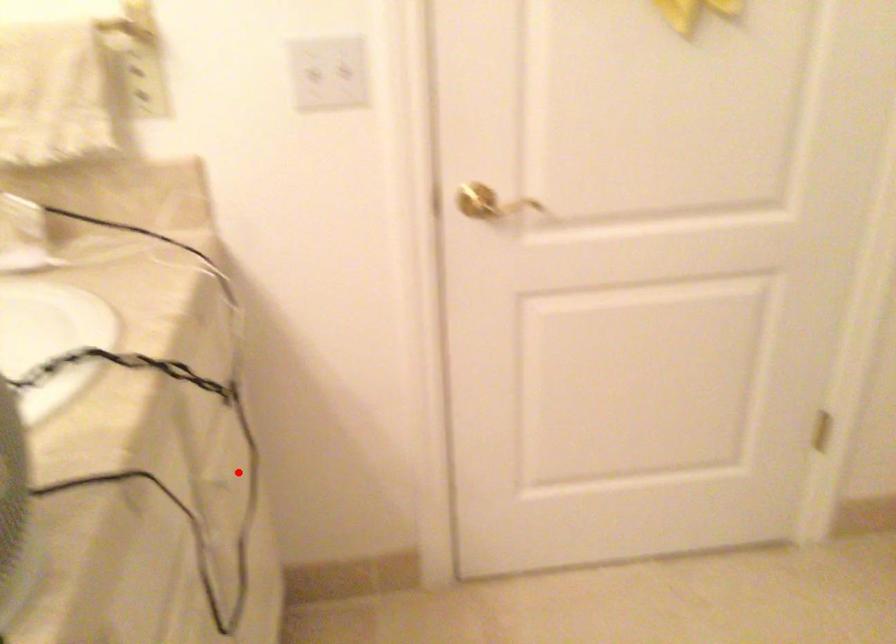
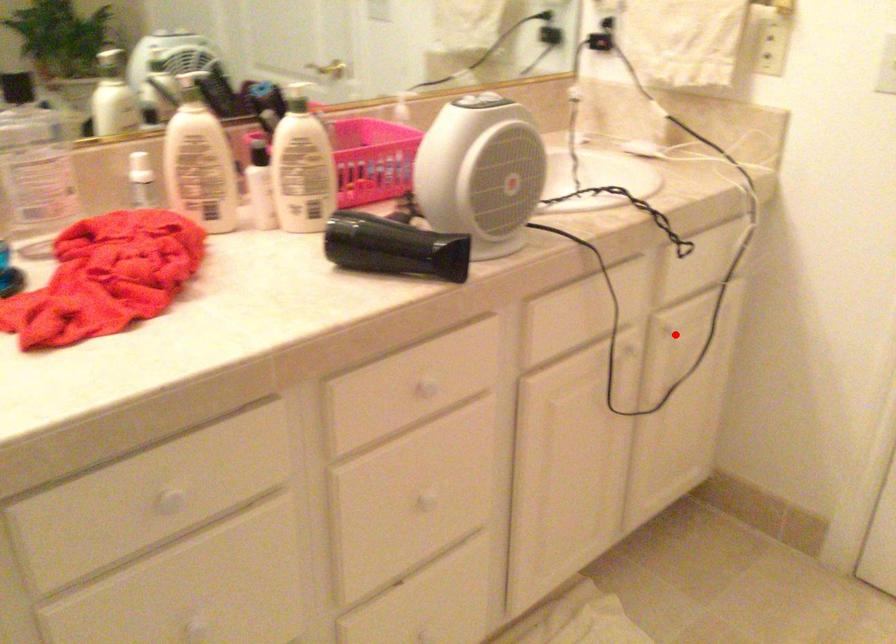
I am providing you with two images of the same scene from different viewpoints. A red point is marked on the first image and another point is marked on the second image. Does the point marked in image1 correspond to the same location as the one in image2?

Yes